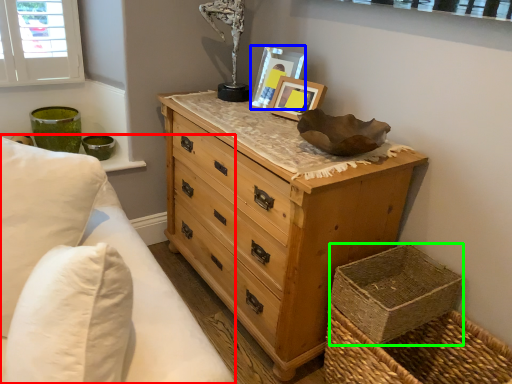
Question: Based on their relative distances, which object is nearer to bedding (highlighted by a red box)? Choose from picture frame (highlighted by a blue box) and basket container (highlighted by a green box).

Choices:
 (A) picture frame
 (B) basket container

Answer: (B)